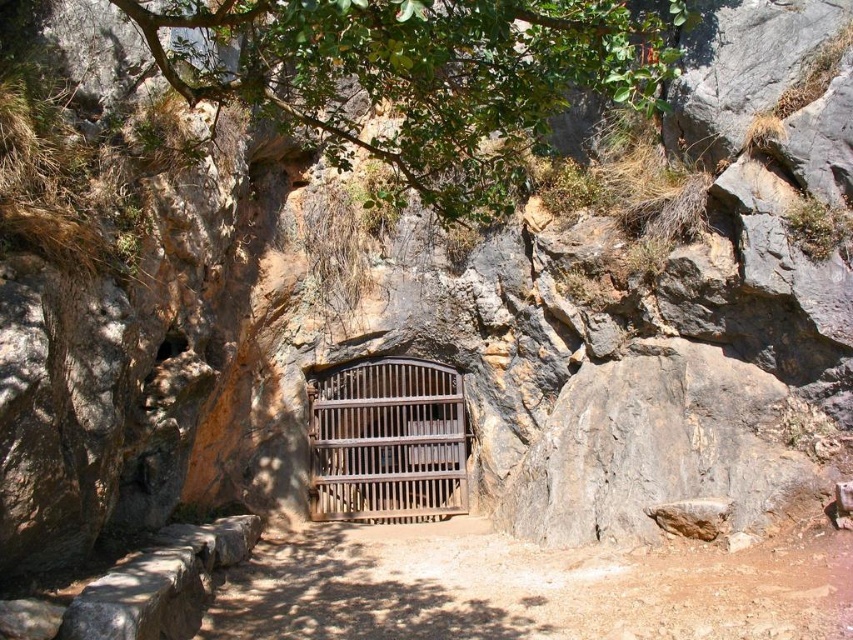
Is point (463, 28) closer to camera compared to point (322, 404)?

Yes, point (463, 28) is closer to viewer.

Can you confirm if green leafy tree at upper center is taller than brown wooden gate at center?

No.

Identify the location of green leafy tree at upper center. The image size is (853, 640). (421, 76).

Find the location of `green leafy tree at upper center`. green leafy tree at upper center is located at coordinates (421, 76).